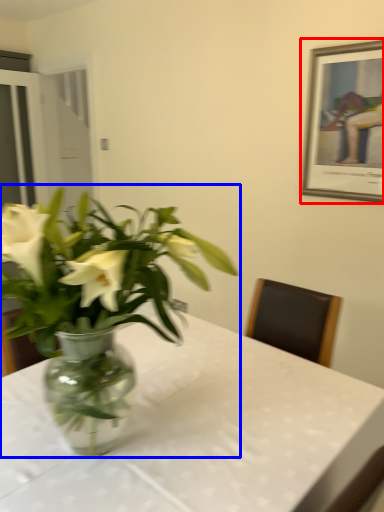
Question: Which object appears farthest to the camera in this image, picture frame (highlighted by a red box) or houseplant (highlighted by a blue box)?

Choices:
 (A) picture frame
 (B) houseplant

Answer: (A)